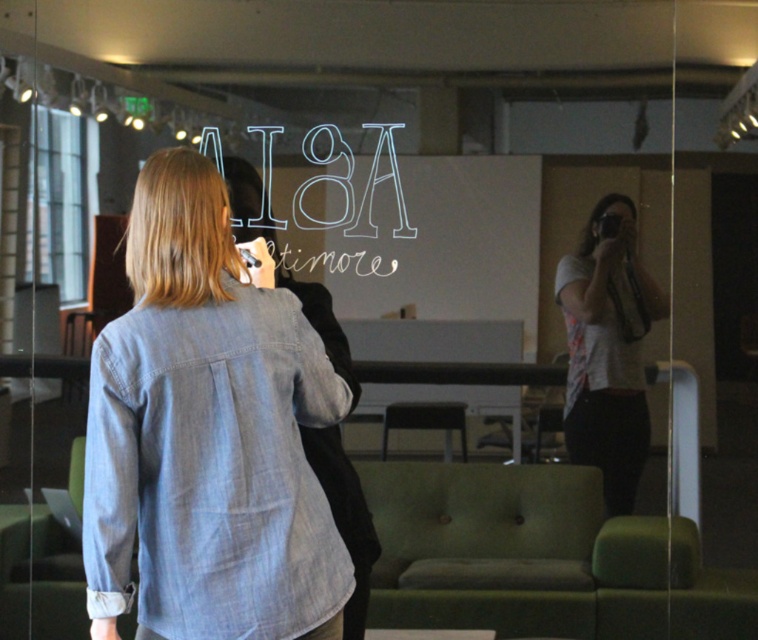
Is white printed shirt at center positioned at the back of white chalk writing at center?

No, white printed shirt at center is in front of white chalk writing at center.

Which is below, white printed shirt at center or white chalk writing at center?

white printed shirt at center

Is point (644, 276) farther from camera compared to point (299, 193)?

No.

The height and width of the screenshot is (640, 758). I want to click on white printed shirt at center, so click(x=606, y=349).

Which is in front, point (190, 362) or point (622, 358)?

Positioned in front is point (190, 362).

In the scene shown: Does light blue denim shirt at center have a greater width compared to white printed shirt at center?

Yes, light blue denim shirt at center is wider than white printed shirt at center.

What do you see at coordinates (207, 435) in the screenshot? I see `light blue denim shirt at center` at bounding box center [207, 435].

Locate an element on the screen. light blue denim shirt at center is located at coordinates (207, 435).

Which of these two, light blue denim shirt at center or white chalk writing at center, stands taller?

light blue denim shirt at center

Looking at this image, between light blue denim shirt at center and white chalk writing at center, which one has less height?

white chalk writing at center is shorter.

Is point (240, 292) farther from camera compared to point (309, 266)?

No.

In order to click on light blue denim shirt at center in this screenshot , I will do point(207,435).